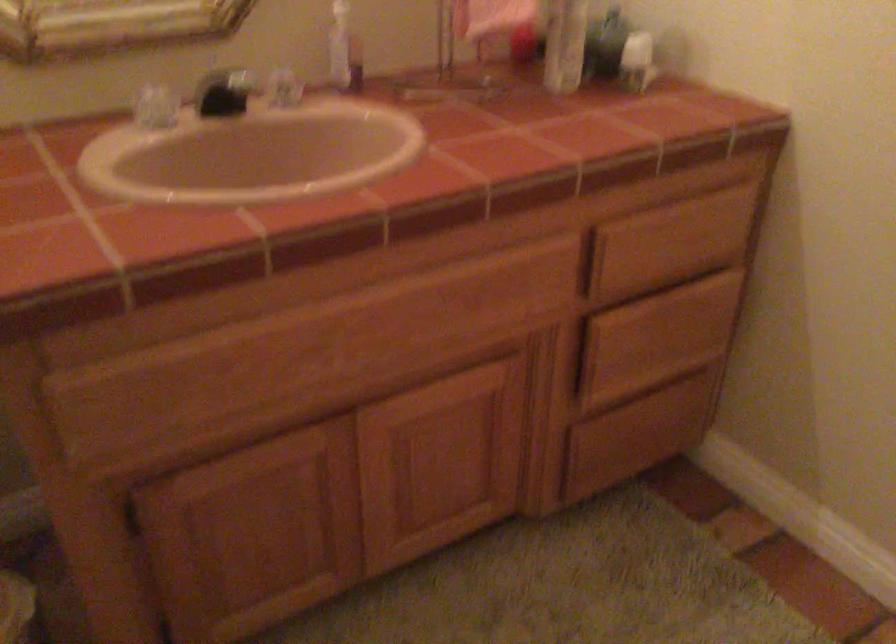
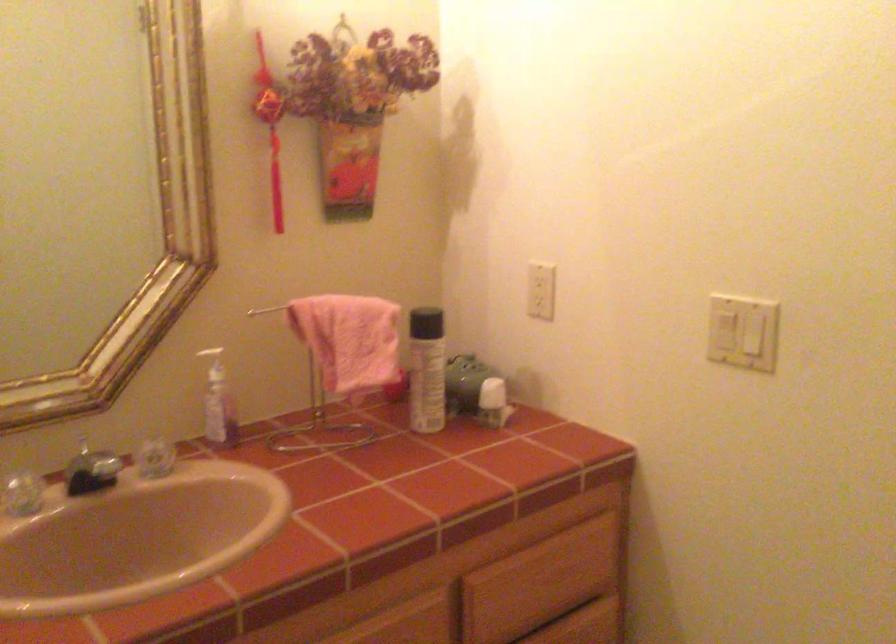
What movement of the cameraman would produce the second image?

The cameraman walked toward right, backward.